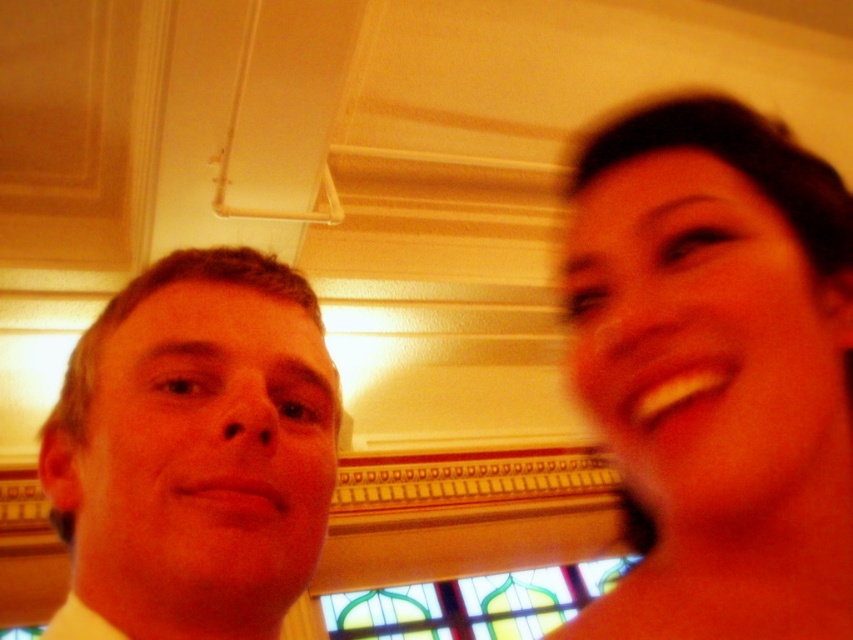
Based on the coordinates provided, where exactly is the smooth skin at right located in the image?

The smooth skin at right is located at the 2D coordinates point (717, 371).